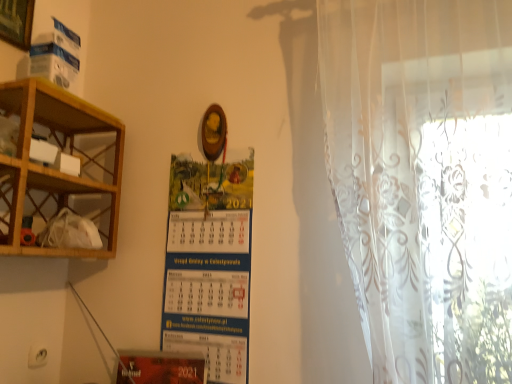
Question: Is blue paper calendar at center wider or thinner than transparent floral curtain at right?

Choices:
 (A) wide
 (B) thin

Answer: (B)

Question: Is blue paper calendar at center bigger or smaller than transparent floral curtain at right?

Choices:
 (A) big
 (B) small

Answer: (B)

Question: Estimate the real-world distances between objects in this image. Which object is closer to the wooden picture frame at upper left?

Choices:
 (A) transparent floral curtain at right
 (B) wooden shelf at left
 (C) blue paper calendar at center

Answer: (B)

Question: Which is farther from the wooden shelf at left?

Choices:
 (A) wooden picture frame at upper left
 (B) transparent floral curtain at right
 (C) blue paper calendar at center

Answer: (B)